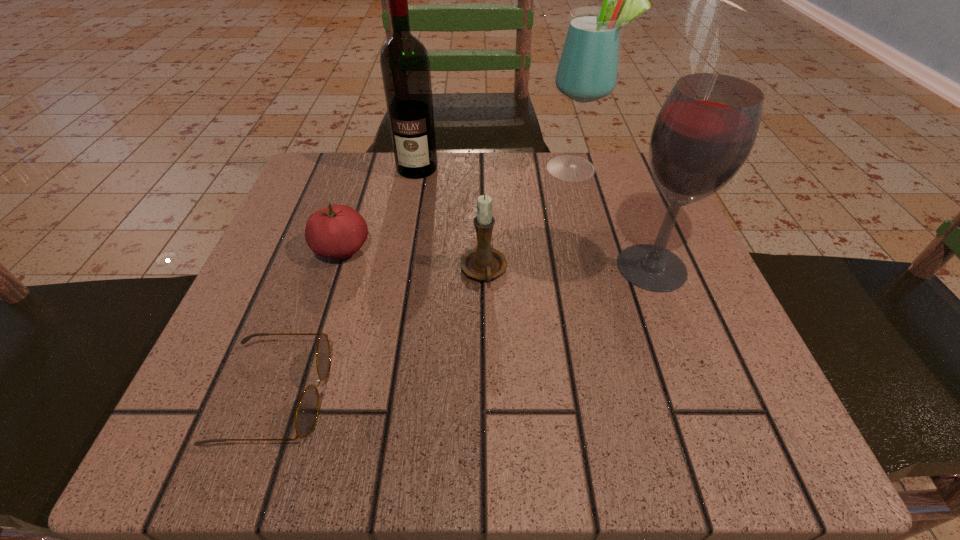
Select which object is the second closest to the leftmost alcohol. Please provide its 2D coordinates. Your answer should be formatted as a tuple, i.e. [(x, y)], where the tuple contains the x and y coordinates of a point satisfying the conditions above.

[(588, 67)]

I want to click on object that is the fourth closest to the shortest alcohol, so click(338, 231).

You are a GUI agent. You are given a task and a screenshot of the screen. Output one action in this format:
    pyautogui.click(x=<x>, y=<y>)
    Task: Click on the third closest alcohol to the second shortest object
    This screenshot has height=540, width=960.
    Given the screenshot: What is the action you would take?
    pyautogui.click(x=706, y=129)

Choose which alcohol is the second nearest neighbor to the third shortest object. Please provide its 2D coordinates. Your answer should be formatted as a tuple, i.e. [(x, y)], where the tuple contains the x and y coordinates of a point satisfying the conditions above.

[(588, 67)]

The width and height of the screenshot is (960, 540). I want to click on vacant area in the image that satisfies the following two spatial constraints: 1. on the side of the candle holder with the handle; 2. on the lenses of the nearest object, so click(485, 395).

Find the location of a particular element. This screenshot has height=540, width=960. vacant space that satisfies the following two spatial constraints: 1. on the front and back of the fourth shortest object; 2. on the left side of the third object from left to right is located at coordinates (399, 267).

Find the location of a particular element. Image resolution: width=960 pixels, height=540 pixels. free space in the image that satisfies the following two spatial constraints: 1. on the front and back of the leftmost alcohol; 2. on the lenses of the sunglasses is located at coordinates 376,395.

Locate an element on the screen. This screenshot has width=960, height=540. vacant area in the image that satisfies the following two spatial constraints: 1. on the side of the candle holder with the handle; 2. on the lenses of the nearest object is located at coordinates (485, 395).